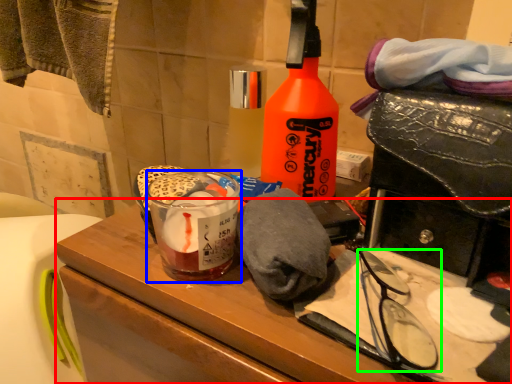
Question: Which object is the closest to the vanity (highlighted by a red box)? Choose among these: beverage (highlighted by a blue box) or glasses (highlighted by a green box).

Choices:
 (A) beverage
 (B) glasses

Answer: (A)